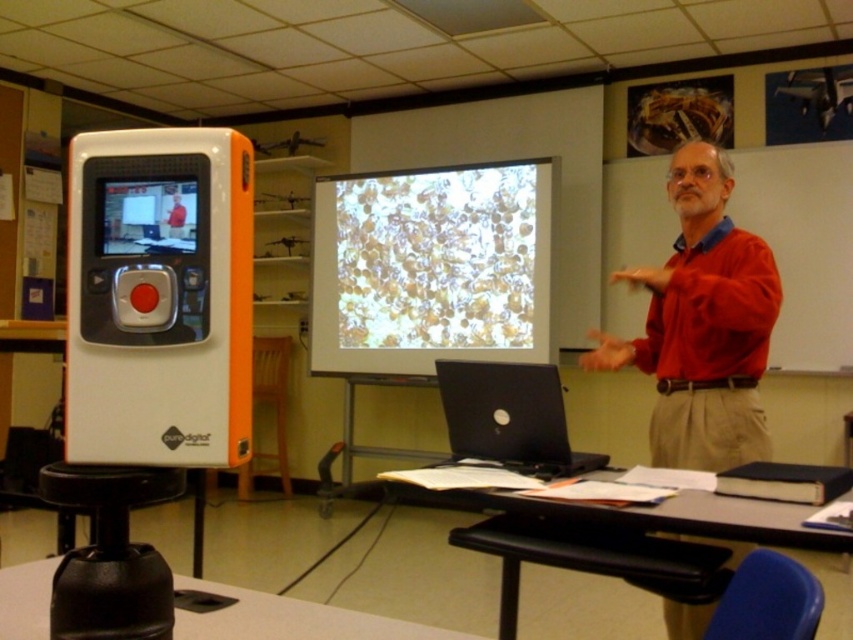
Does smooth black table at lower center have a smaller size compared to black matte laptop at center?

Incorrect, smooth black table at lower center is not smaller in size than black matte laptop at center.

Can you confirm if smooth black table at lower center is taller than black matte laptop at center?

Incorrect, smooth black table at lower center's height is not larger of black matte laptop at center's.

Between point (485, 488) and point (556, 372), which one is positioned in front?

Point (485, 488) is in front.

Where is `smooth black table at lower center`? The height and width of the screenshot is (640, 853). smooth black table at lower center is located at coordinates (636, 500).

Can you confirm if white matte projection screen at center is positioned above black plastic table at lower left?

Yes.

Does white matte projection screen at center appear under black plastic table at lower left?

Actually, white matte projection screen at center is above black plastic table at lower left.

Who is more distant from viewer, (387, 220) or (1, 614)?

The point (387, 220) is more distant.

The width and height of the screenshot is (853, 640). I want to click on white matte projection screen at center, so click(x=431, y=268).

Is white matte projection screen at center thinner than black matte laptop at center?

In fact, white matte projection screen at center might be wider than black matte laptop at center.

Can you confirm if white matte projection screen at center is shorter than black matte laptop at center?

Incorrect, white matte projection screen at center's height does not fall short of black matte laptop at center's.

What do you see at coordinates (431, 268) in the screenshot?
I see `white matte projection screen at center` at bounding box center [431, 268].

Image resolution: width=853 pixels, height=640 pixels. Find the location of `white matte projection screen at center`. white matte projection screen at center is located at coordinates (431, 268).